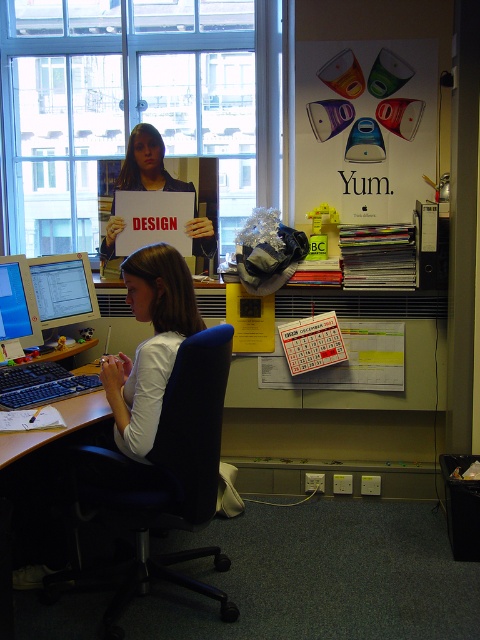
Question: Considering the relative positions of matte black sign at center and black plastic keyboard at lower left in the image provided, where is matte black sign at center located with respect to black plastic keyboard at lower left?

Choices:
 (A) left
 (B) right

Answer: (B)

Question: Can you confirm if blue fabric swivel chair at center is positioned to the left of black plastic keyboard at lower left?

Choices:
 (A) no
 (B) yes

Answer: (A)

Question: Which of the following is the farthest from the observer?

Choices:
 (A) black plastic keyboard at lower left
 (B) blue fabric swivel chair at center
 (C) matte black sign at center

Answer: (C)

Question: Which of the following is the closest to the observer?

Choices:
 (A) blue fabric swivel chair at center
 (B) matte black sign at center

Answer: (A)

Question: Which object appears farthest from the camera in this image?

Choices:
 (A) black plastic keyboard at lower left
 (B) blue fabric swivel chair at center

Answer: (B)

Question: Is matte black sign at center closer to camera compared to black plastic keyboard at lower left?

Choices:
 (A) no
 (B) yes

Answer: (A)